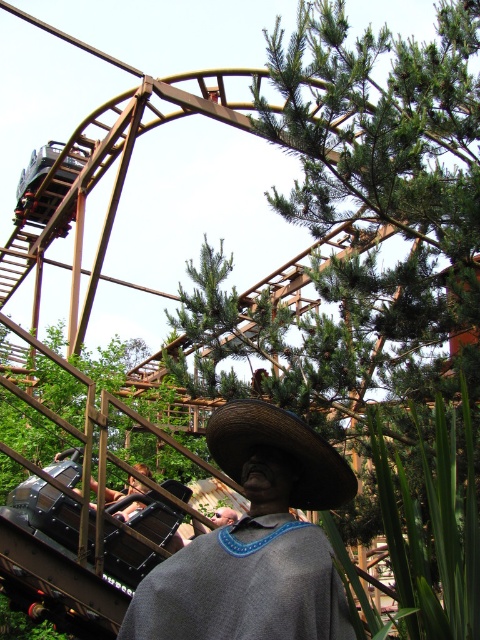
What do you see at coordinates (255, 541) in the screenshot? The image size is (480, 640). I see `woven straw hat at center` at bounding box center [255, 541].

Identify the location of woven straw hat at center. This screenshot has width=480, height=640. (255, 541).

Find the location of a particular element. Image resolution: width=480 pixels, height=640 pixels. woven straw hat at center is located at coordinates (255, 541).

Is point (295, 456) positioned before point (107, 492)?

Yes, it is.

Does woven straw cowboy hat at center appear on the right side of metallic silver helmet at lower center?

Indeed, woven straw cowboy hat at center is positioned on the right side of metallic silver helmet at lower center.

Between point (250, 452) and point (144, 467), which one is positioned in front?

Point (250, 452) is more forward.

Where is `woven straw cowboy hat at center`? woven straw cowboy hat at center is located at coordinates pyautogui.click(x=280, y=451).

Does woven straw hat at center appear on the right side of metallic silver helmet at lower center?

Indeed, woven straw hat at center is positioned on the right side of metallic silver helmet at lower center.

Can you confirm if woven straw hat at center is wider than metallic silver helmet at lower center?

Yes, woven straw hat at center is wider than metallic silver helmet at lower center.

Image resolution: width=480 pixels, height=640 pixels. I want to click on woven straw hat at center, so click(x=255, y=541).